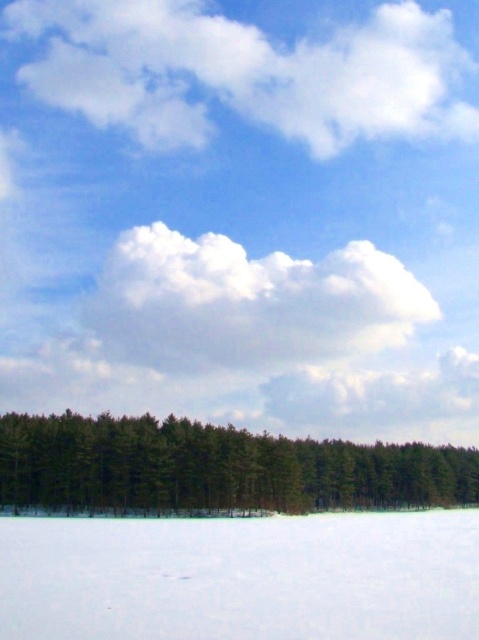
Which is below, white powdery snow at lower center or white fluffy cloud at upper center?

Positioned lower is white powdery snow at lower center.

Where is `white powdery snow at lower center`? white powdery snow at lower center is located at coordinates (241, 577).

Is point (50, 636) closer to viewer compared to point (92, 93)?

That is True.

The height and width of the screenshot is (640, 479). In order to click on white powdery snow at lower center in this screenshot , I will do `click(241, 577)`.

Does white fluffy cloud at upper center appear under white fluffy cloud at center?

No.

Which is more to the right, white fluffy cloud at upper center or white fluffy cloud at center?

Positioned to the right is white fluffy cloud at center.

Is point (381, 93) behind point (124, 352)?

Yes, it is behind point (124, 352).

This screenshot has height=640, width=479. In order to click on white fluffy cloud at upper center in this screenshot , I will do `click(246, 72)`.

Which is in front, point (159, 524) or point (225, 435)?

Point (159, 524) is in front.

From the picture: Does white powdery snow at lower center come behind green matte trees at lower center?

No, it is not.

Is point (474, 518) closer to camera compared to point (192, 502)?

Yes.

Locate an element on the screen. The width and height of the screenshot is (479, 640). white powdery snow at lower center is located at coordinates (241, 577).